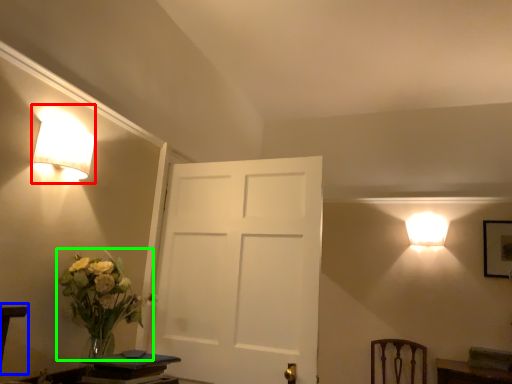
Question: Based on their relative distances, which object is farther from lamp (highlighted by a red box)? Choose from table (highlighted by a blue box) and floral arrangement (highlighted by a green box).

Choices:
 (A) table
 (B) floral arrangement

Answer: (A)